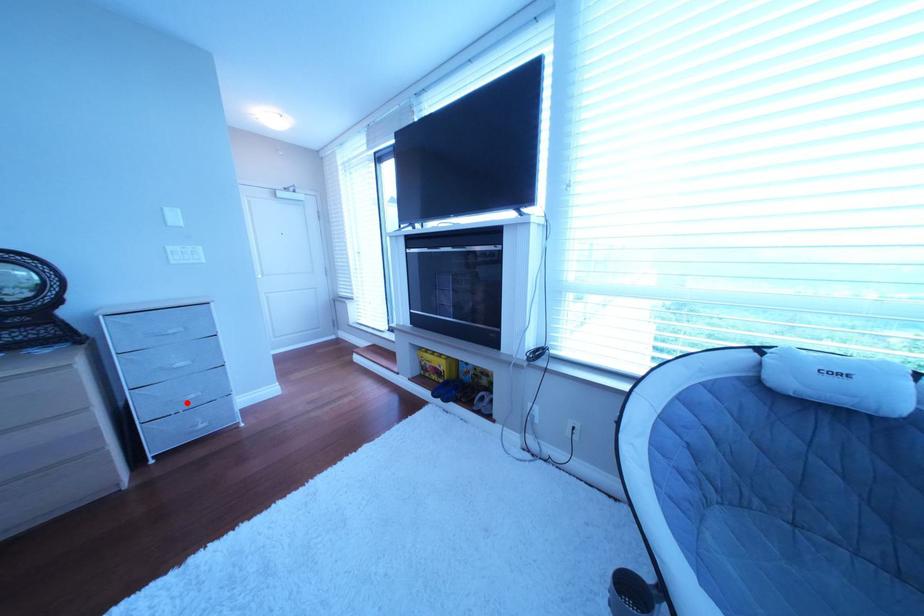
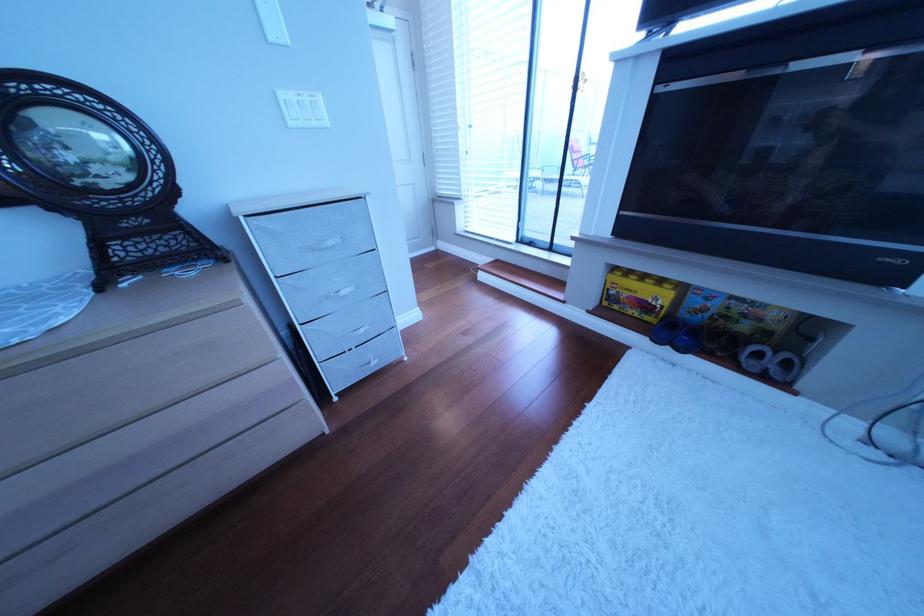
Question: I am providing you with two images of the same scene from different viewpoints. Image1 has a red point marked. In image2, the corresponding 3D location appears at what relative position? Reply with the corresponding letter.

Choices:
 (A) Closer
 (B) Farther

Answer: (A)